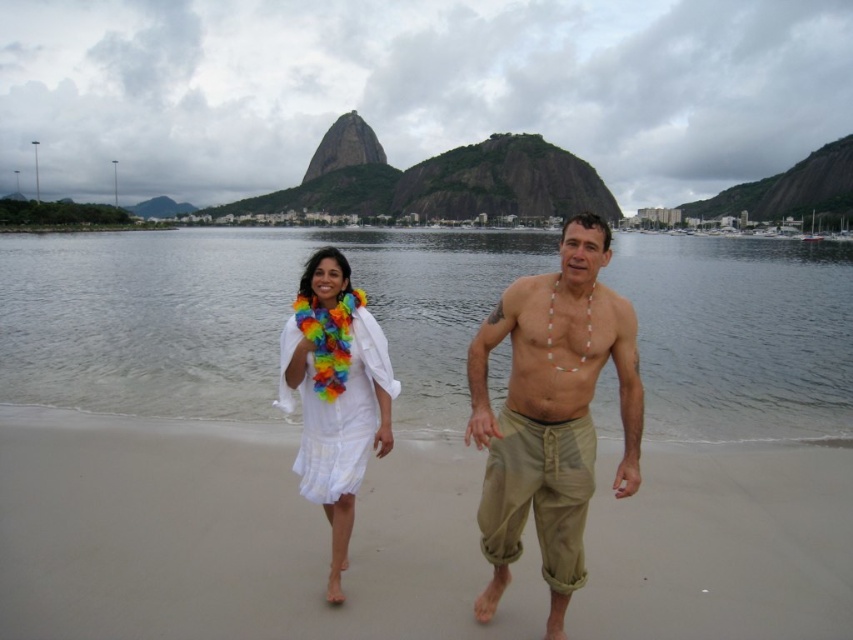
Who is shorter, clear water at center or beige fabric shorts at center?

Standing shorter between the two is beige fabric shorts at center.

Which of these two, clear water at center or beige fabric shorts at center, stands taller?

Standing taller between the two is clear water at center.

Who is more distant from viewer, (x=689, y=384) or (x=576, y=376)?

The point (x=689, y=384) is behind.

The height and width of the screenshot is (640, 853). In order to click on clear water at center in this screenshot , I will do `click(238, 314)`.

Is clear water at center taller than white cotton dress at center?

Correct, clear water at center is much taller as white cotton dress at center.

This screenshot has width=853, height=640. I want to click on clear water at center, so click(x=238, y=314).

Which is behind, point (514, 408) or point (323, 400)?

The point (323, 400) is behind.

This screenshot has height=640, width=853. What are the coordinates of `white cotton dress at center` in the screenshot? It's located at (550, 413).

The width and height of the screenshot is (853, 640). In order to click on white cotton dress at center in this screenshot , I will do `click(550, 413)`.